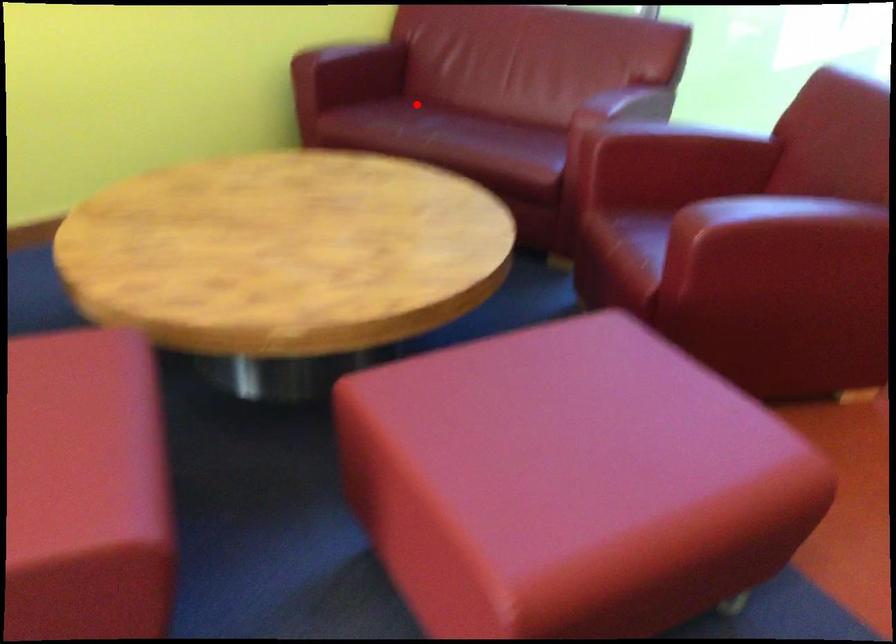
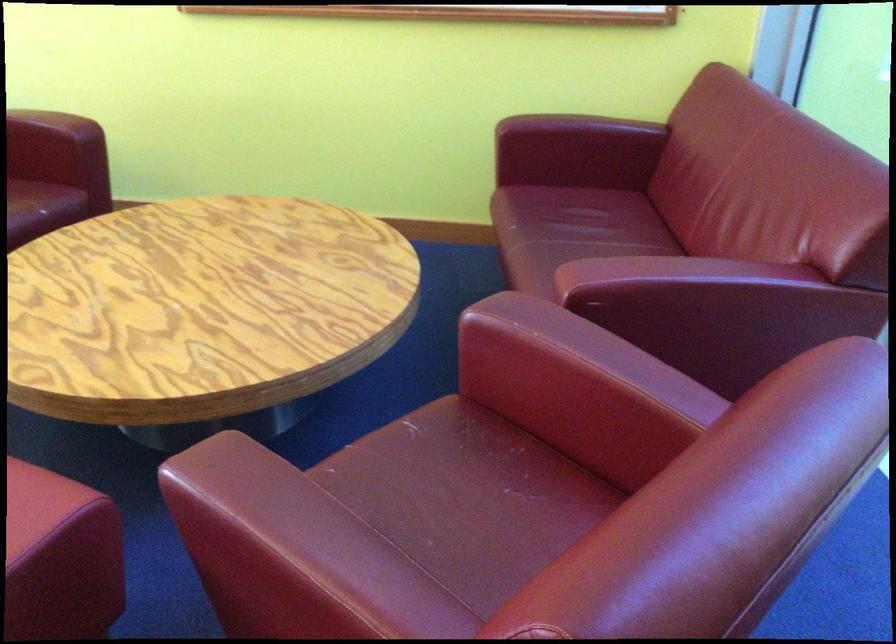
Question: A red point is marked in image1. In image2, is the corresponding 3D point closer to the camera or farther? Reply with the corresponding letter.

Choices:
 (A) The corresponding 3D point is closer.
 (B) The corresponding 3D point is farther.

Answer: (A)